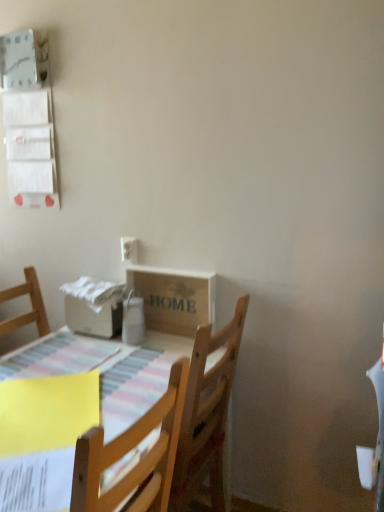
Image resolution: width=384 pixels, height=512 pixels. I want to click on vacant region below wooden crate at center (from a real-world perspective), so click(x=171, y=339).